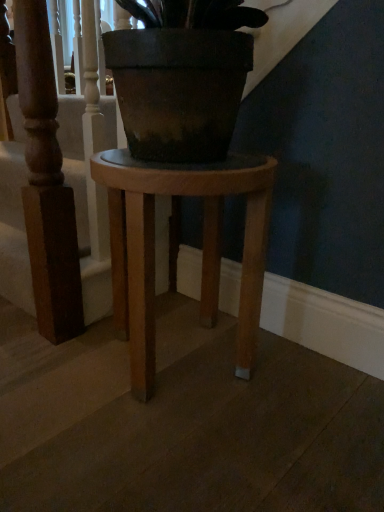
Question: Does wooden stool at center appear on the left side of wooden stool at center?

Choices:
 (A) no
 (B) yes

Answer: (B)

Question: From a real-world perspective, is wooden stool at center under wooden stool at center?

Choices:
 (A) no
 (B) yes

Answer: (A)

Question: Is wooden stool at center completely or partially inside wooden stool at center?

Choices:
 (A) no
 (B) yes

Answer: (A)

Question: Is wooden stool at center outside of wooden stool at center?

Choices:
 (A) no
 (B) yes

Answer: (B)

Question: From the image's perspective, does wooden stool at center appear lower than wooden stool at center?

Choices:
 (A) no
 (B) yes

Answer: (A)

Question: Considering the relative sizes of wooden stool at center and wooden stool at center in the image provided, is wooden stool at center thinner than wooden stool at center?

Choices:
 (A) no
 (B) yes

Answer: (B)

Question: Does wooden stool at center have a greater height compared to wooden stool at center?

Choices:
 (A) no
 (B) yes

Answer: (A)

Question: Considering the relative sizes of wooden stool at center and wooden stool at center in the image provided, is wooden stool at center smaller than wooden stool at center?

Choices:
 (A) yes
 (B) no

Answer: (B)

Question: Can we say wooden stool at center lies outside wooden stool at center?

Choices:
 (A) yes
 (B) no

Answer: (A)

Question: From a real-world perspective, is wooden stool at center located beneath wooden stool at center?

Choices:
 (A) no
 (B) yes

Answer: (B)

Question: Does wooden stool at center touch wooden stool at center?

Choices:
 (A) yes
 (B) no

Answer: (B)

Question: Is wooden stool at center wider than wooden stool at center?

Choices:
 (A) yes
 (B) no

Answer: (A)

Question: In terms of width, does wooden stool at center look wider or thinner when compared to wooden stool at center?

Choices:
 (A) wide
 (B) thin

Answer: (B)